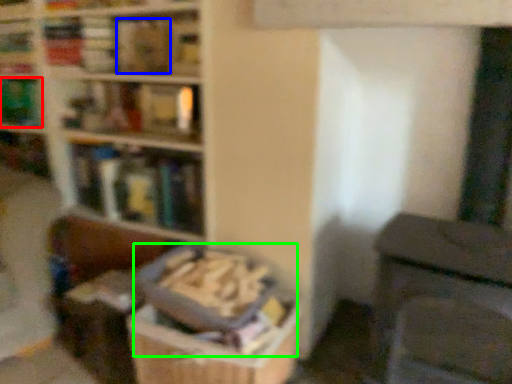
Question: Which object is the closest to the book (highlighted by a red box)? Choose among these: book (highlighted by a blue box) or book (highlighted by a green box).

Choices:
 (A) book
 (B) book

Answer: (A)